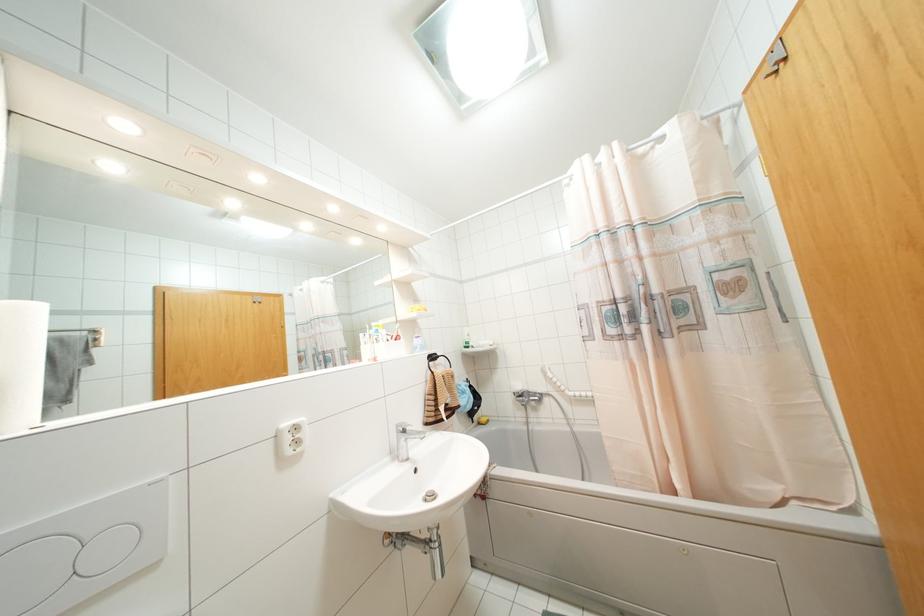
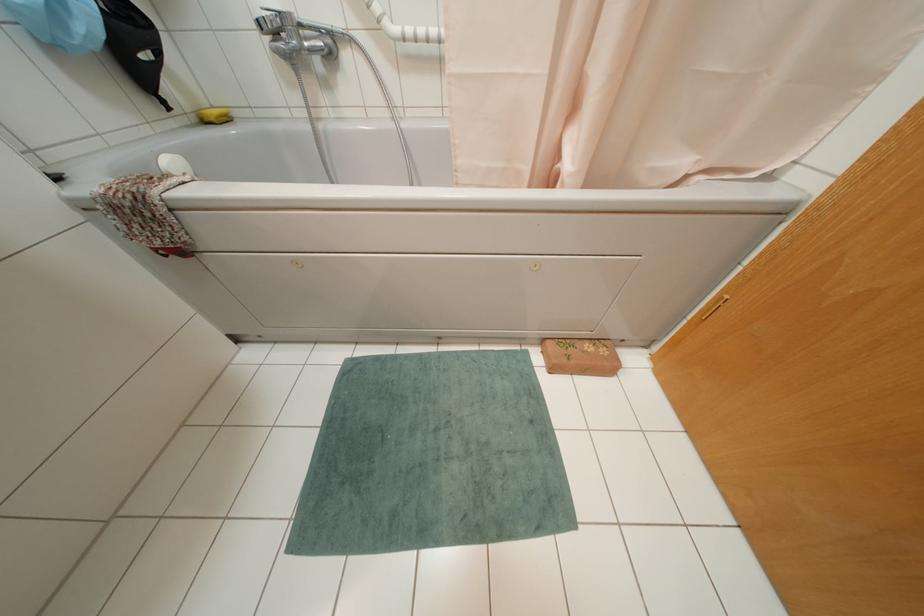
In the second image, find the point that corresponds to (x=479, y=423) in the first image.

(202, 121)